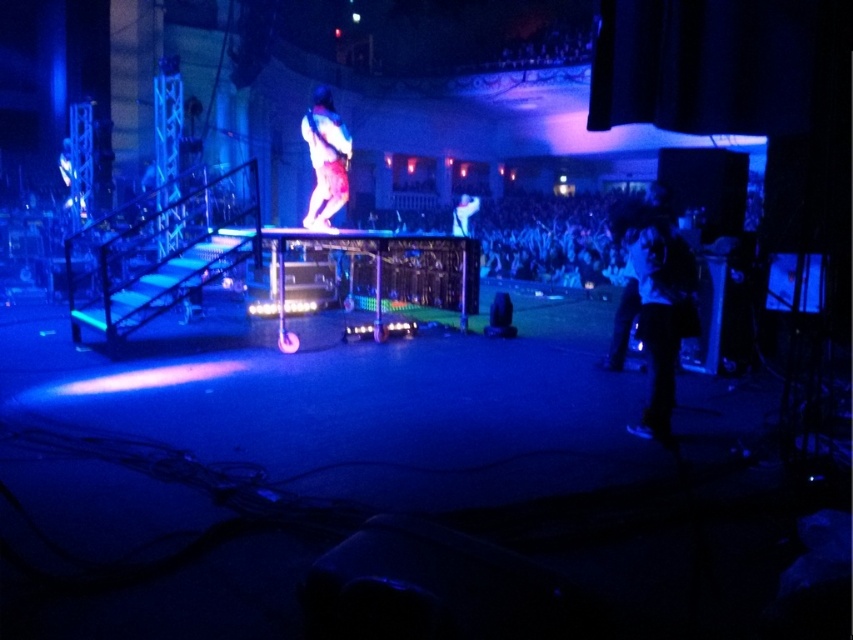
You are a stagehand preparing for a performance. You need to move the shiny metallic guitar at center to the left side of the stage. However, there is an equipment rack blocking your path. Can you move the black matte jacket at right out of the way first to access the guitar?

The black matte jacket at right is in front of the shiny metallic guitar at center, so moving the black matte jacket at right first would allow you to access the guitar.

You are a stagehand preparing to move the black matte jacket at right and the shiny silver guitar at center to the storage room. Which object requires more horizontal space when moving through the narrow backstage corridor?

The shiny silver guitar at center requires more horizontal space because it has a greater width than the black matte jacket at right.

You are standing at the back of the stage and want to move towards the front. You see two points marked on the stage floor. Which point is closer to the front of the stage, point (651, 374) or point (463, 220)?

Point (651, 374) is closer to the front of the stage because it is in front of point (463, 220).